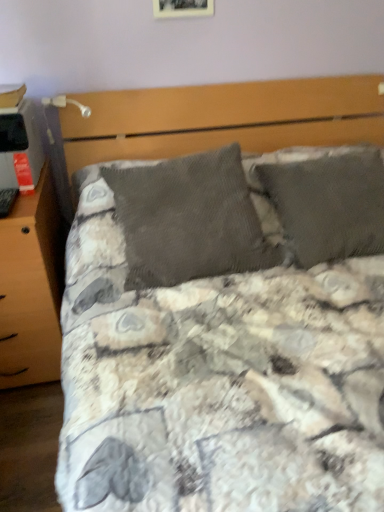
Question: Could you tell me if wooden photo frame at upper center is facing wooden nightstand at left?

Choices:
 (A) no
 (B) yes

Answer: (A)

Question: Is wooden photo frame at upper center positioned in front of wooden nightstand at left?

Choices:
 (A) yes
 (B) no

Answer: (B)

Question: Considering the relative sizes of wooden photo frame at upper center and wooden nightstand at left in the image provided, is wooden photo frame at upper center wider than wooden nightstand at left?

Choices:
 (A) yes
 (B) no

Answer: (B)

Question: Is wooden photo frame at upper center smaller than wooden nightstand at left?

Choices:
 (A) no
 (B) yes

Answer: (B)

Question: Can we say wooden photo frame at upper center lies outside wooden nightstand at left?

Choices:
 (A) yes
 (B) no

Answer: (A)

Question: From the image's perspective, is metallic silver table lamp at upper left positioned above or below matte black desktop at left?

Choices:
 (A) below
 (B) above

Answer: (B)

Question: From a real-world perspective, is metallic silver table lamp at upper left above or below matte black desktop at left?

Choices:
 (A) above
 (B) below

Answer: (A)

Question: Which is correct: metallic silver table lamp at upper left is inside matte black desktop at left, or outside of it?

Choices:
 (A) outside
 (B) inside

Answer: (A)

Question: In the image, is metallic silver table lamp at upper left positioned in front of or behind matte black desktop at left?

Choices:
 (A) behind
 (B) front

Answer: (A)

Question: From a real-world perspective, is wooden nightstand at left above or below matte black desktop at left?

Choices:
 (A) below
 (B) above

Answer: (A)

Question: Is point pos(31,309) closer or farther from the camera than point pos(23,152)?

Choices:
 (A) closer
 (B) farther

Answer: (B)

Question: Considering their positions, is wooden nightstand at left located in front of or behind matte black desktop at left?

Choices:
 (A) behind
 (B) front

Answer: (B)

Question: Is wooden nightstand at left wider or thinner than matte black desktop at left?

Choices:
 (A) thin
 (B) wide

Answer: (B)

Question: Do you think wooden nightstand at left is within wooden photo frame at upper center, or outside of it?

Choices:
 (A) inside
 (B) outside

Answer: (B)

Question: From a real-world perspective, is wooden nightstand at left physically located above or below wooden photo frame at upper center?

Choices:
 (A) below
 (B) above

Answer: (A)